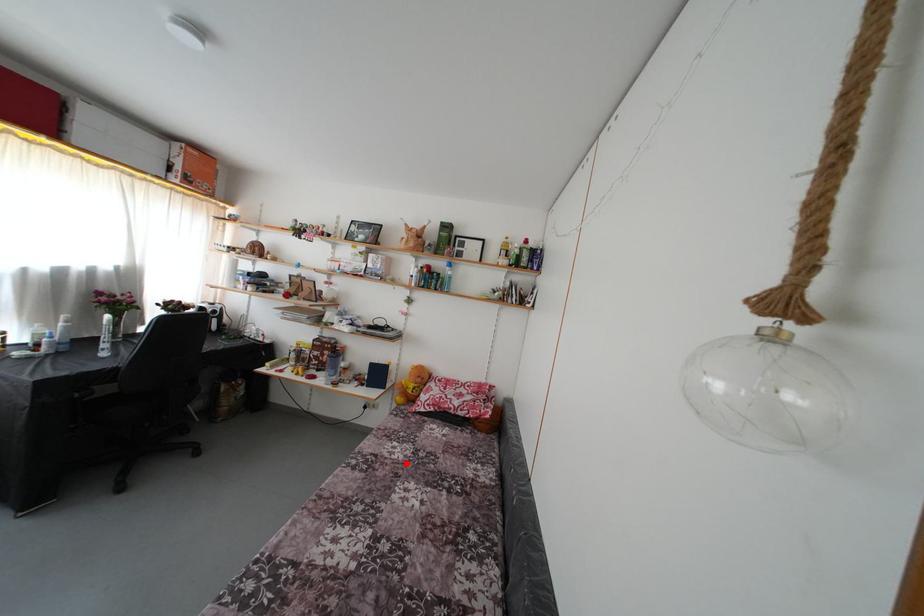
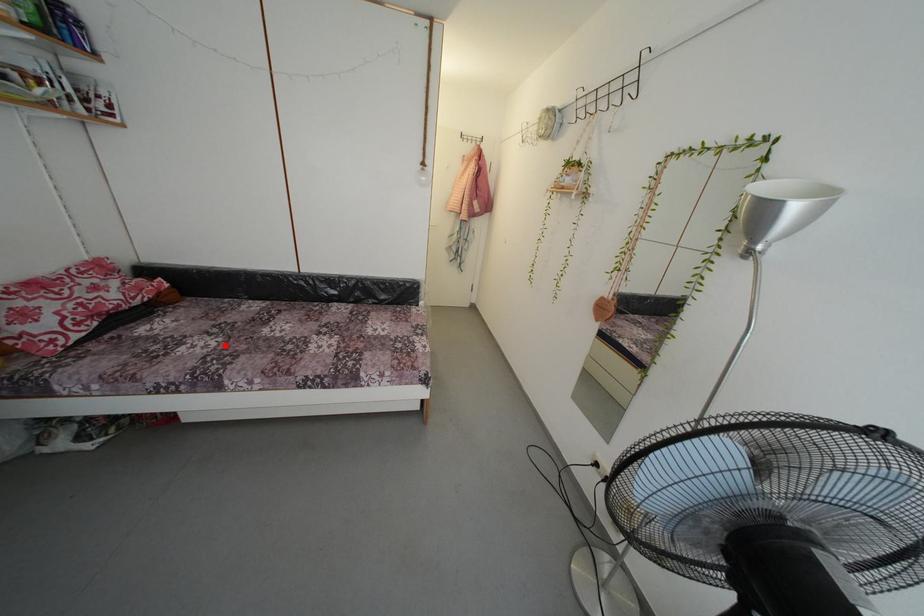
I am providing you with two images of the same scene from different viewpoints. A red point is marked on the first image and another point is marked on the second image. Does the point marked in image1 correspond to the same location as the one in image2?

Yes